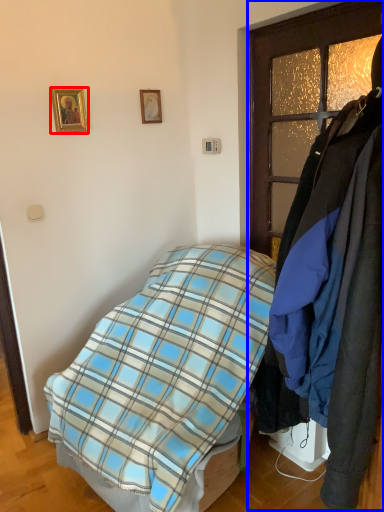
Question: Which object appears closest to the camera in this image, picture frame (highlighted by a red box) or closet (highlighted by a blue box)?

Choices:
 (A) picture frame
 (B) closet

Answer: (B)